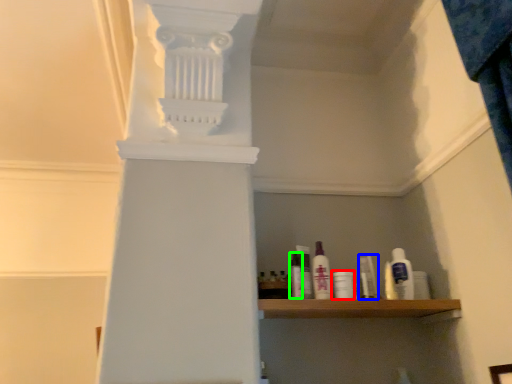
Question: Based on their relative distances, which object is farther from toiletry (highlighted by a red box)? Choose from toiletry (highlighted by a blue box) and toiletry (highlighted by a green box).

Choices:
 (A) toiletry
 (B) toiletry

Answer: (B)